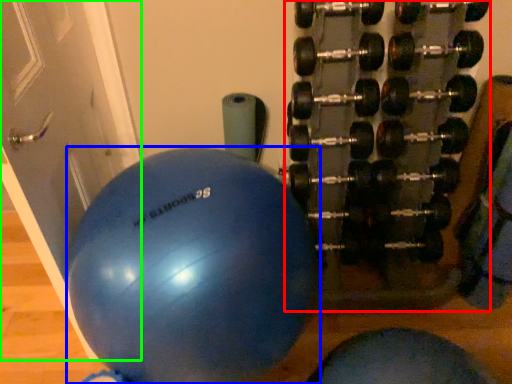
Question: Based on their relative distances, which object is farther from dumbbell (highlighted by a red box)? Choose from ball (highlighted by a blue box) and door (highlighted by a green box).

Choices:
 (A) ball
 (B) door

Answer: (B)